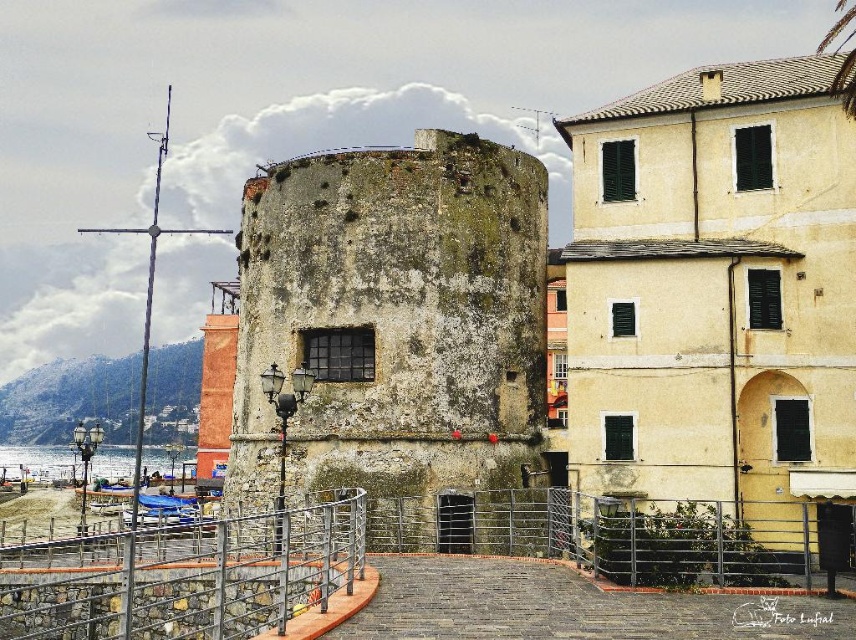
Question: Is weathered stone tower at center in front of metallic gray railing at lower center?

Choices:
 (A) yes
 (B) no

Answer: (B)

Question: Considering the real-world distances, which object is closest to the clear water at lower left?

Choices:
 (A) weathered stone tower at center
 (B) yellowish concrete building at center
 (C) metallic gray railing at lower center

Answer: (A)

Question: Can you confirm if yellowish concrete building at center is positioned above clear water at lower left?

Choices:
 (A) yes
 (B) no

Answer: (A)

Question: Is yellowish concrete building at center bigger than weathered stone tower at center?

Choices:
 (A) no
 (B) yes

Answer: (A)

Question: Which of the following is the closest to the observer?

Choices:
 (A) weathered stone tower at center
 (B) clear water at lower left
 (C) yellowish concrete building at center
 (D) metallic gray railing at lower center

Answer: (D)

Question: Among these points, which one is nearest to the camera?

Choices:
 (A) (789, 212)
 (B) (37, 452)
 (C) (254, 538)
 (D) (467, 349)

Answer: (C)